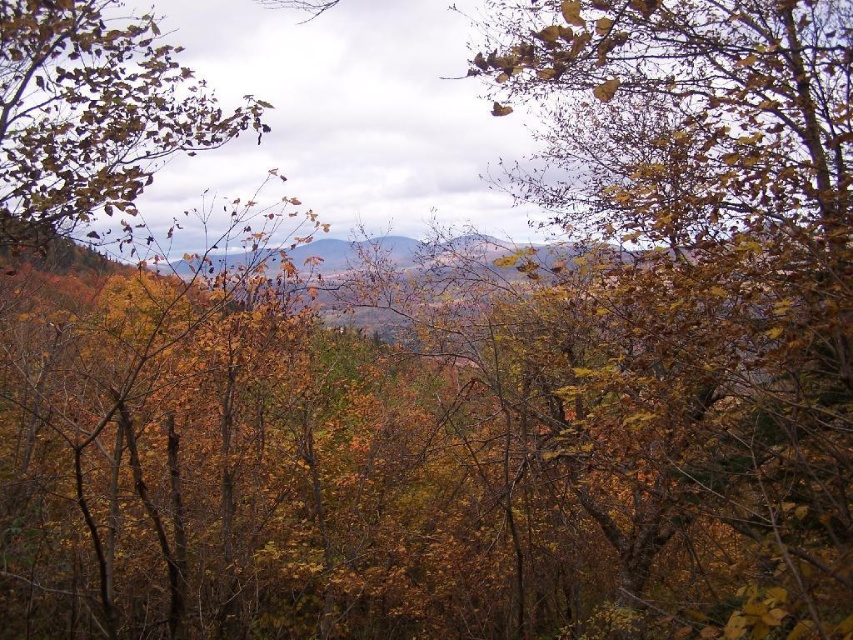
Question: Does golden-brown leaves at center have a greater width compared to brown matte tree at upper left?

Choices:
 (A) no
 (B) yes

Answer: (A)

Question: Which point appears farthest from the camera in this image?

Choices:
 (A) (88, 33)
 (B) (709, 404)

Answer: (A)

Question: Among these objects, which one is nearest to the camera?

Choices:
 (A) golden-brown leaves at center
 (B) brown matte tree at upper left

Answer: (A)

Question: Does golden-brown leaves at center appear over brown matte tree at upper left?

Choices:
 (A) no
 (B) yes

Answer: (A)

Question: Is golden-brown leaves at center thinner than brown matte tree at upper left?

Choices:
 (A) no
 (B) yes

Answer: (B)